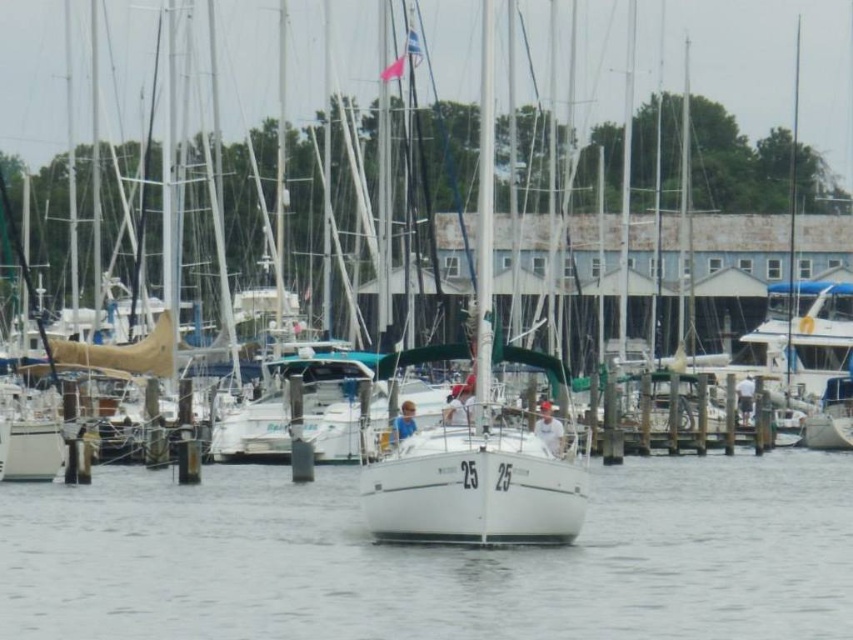
You are a photographer planning to take a photo of the white smooth water at center and the white matte sailboat at center. Since both are white, you want to ensure they are clearly distinguishable in your photo. Based on their positions, which one will naturally appear closer to the camera in the image?

The white smooth water at center is in front of the white matte sailboat at center, so it will naturally appear closer to the camera in the photo.

You are a photographer trying to capture the reflection of the white matte sailboat at center in the white smooth water at center. Based on the scene, can you confirm if the reflection will be visible?

The white smooth water at center is not as tall as the white matte sailboat at center, so the reflection of the white matte sailboat at center may not be fully visible in the water since the water surface is lower than the boat.